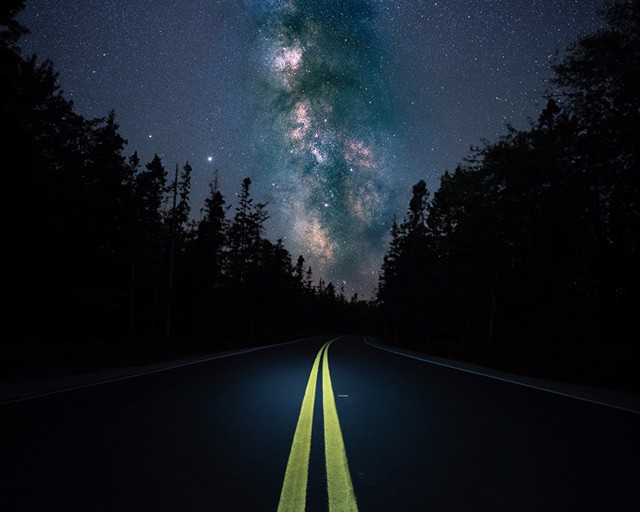
I want to click on bright area from light source, so click(315, 386).